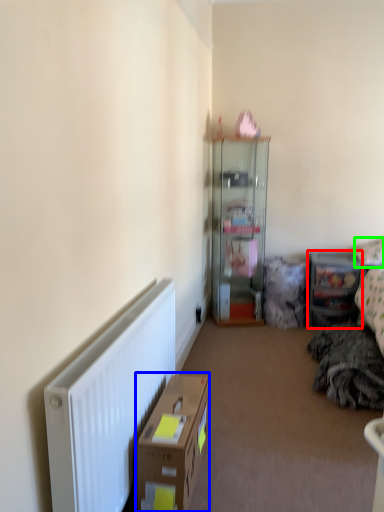
Question: Based on their relative distances, which object is farther from shelf (highlighted by a red box)? Choose from cardboard box (highlighted by a blue box) and pillow (highlighted by a green box).

Choices:
 (A) cardboard box
 (B) pillow

Answer: (A)